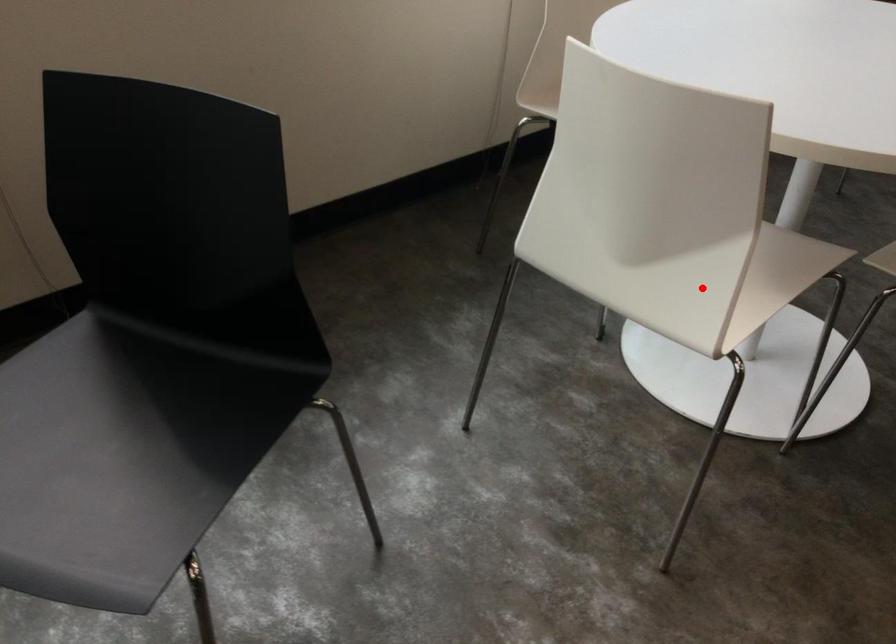
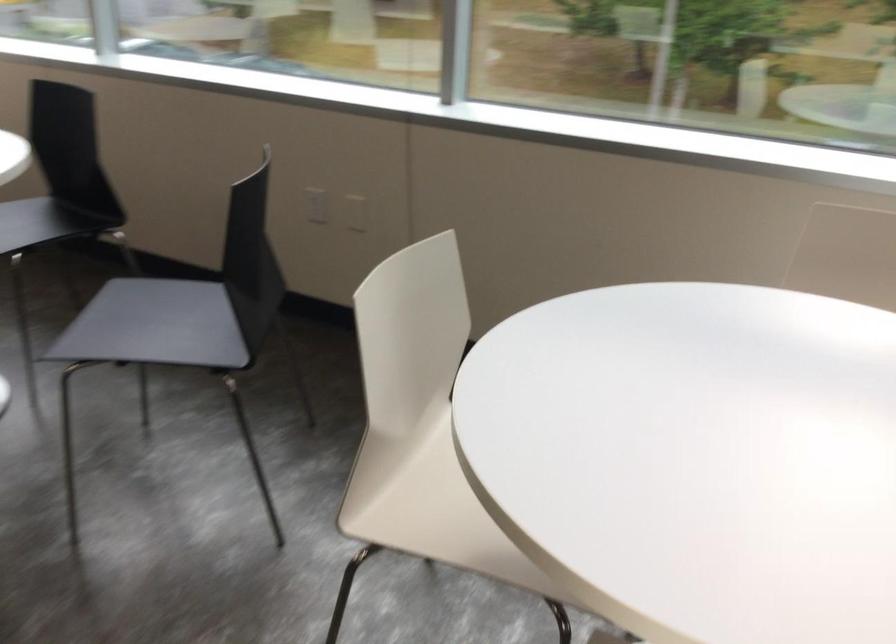
In the second image, find the point that corresponds to the highlighted location in the first image.

(431, 509)